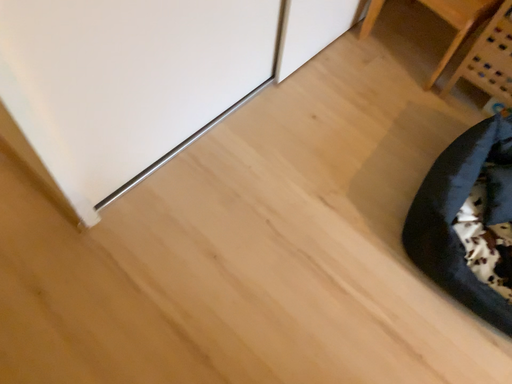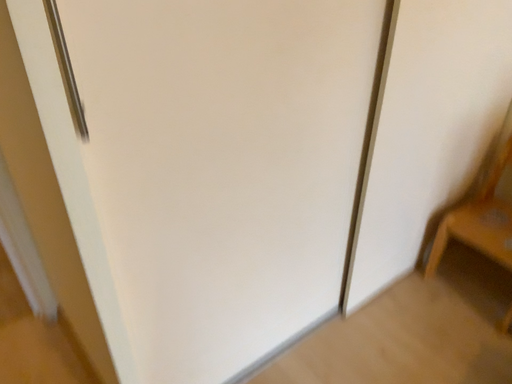
Question: How did the camera likely rotate when shooting the video?

Choices:
 (A) rotated left
 (B) rotated right

Answer: (A)